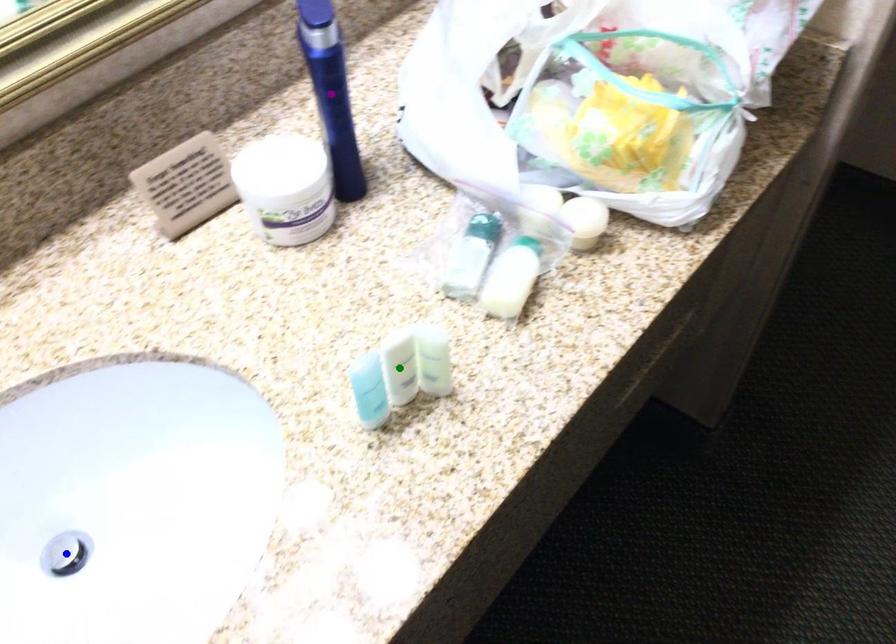
Order these from nearest to farthest:
- green point
- purple point
- blue point

green point → purple point → blue point